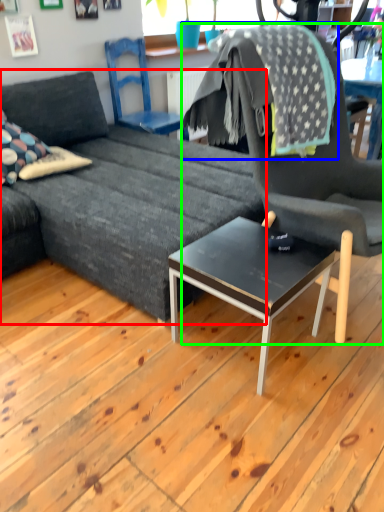
Question: Which object is positioned farthest from studio couch (highlighted by a red box)? Select from blanket (highlighted by a blue box) and chair (highlighted by a green box).

Choices:
 (A) blanket
 (B) chair

Answer: (A)